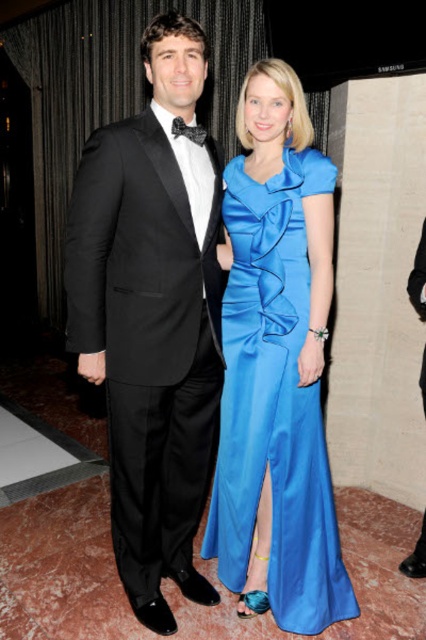
Is point (256, 440) positioned after point (193, 124)?

Yes, point (256, 440) is behind point (193, 124).

Does satin blue dress at center have a greater height compared to black satin bow tie at upper center?

Indeed, satin blue dress at center has a greater height compared to black satin bow tie at upper center.

Is point (284, 276) behind point (178, 132)?

That is True.

You are a GUI agent. You are given a task and a screenshot of the screen. Output one action in this format:
    pyautogui.click(x=<x>, y=<y>)
    Task: Click on the satin blue dress at center
    The width and height of the screenshot is (426, 640).
    Given the screenshot: What is the action you would take?
    (275, 403)

Based on the photo, is black satin tuxedo at left bigger than black satin bow tie at upper center?

Yes, black satin tuxedo at left is bigger than black satin bow tie at upper center.

Who is shorter, black satin tuxedo at left or black satin bow tie at upper center?

Standing shorter between the two is black satin bow tie at upper center.

Is point (183, 586) farther from viewer compared to point (175, 138)?

Yes, point (183, 586) is farther from viewer.

Find the location of `black satin tuxedo at left`. black satin tuxedo at left is located at coordinates (152, 317).

Is point (164, 237) more distant than point (321, 525)?

No, it is not.

Does black satin tuxedo at left have a lesser height compared to satin blue dress at center?

No, black satin tuxedo at left is not shorter than satin blue dress at center.

Does point (175, 196) lie behind point (268, 413)?

No.

You are a GUI agent. You are given a task and a screenshot of the screen. Output one action in this format:
    pyautogui.click(x=<x>, y=<y>)
    Task: Click on the black satin tuxedo at left
    
    Given the screenshot: What is the action you would take?
    152,317